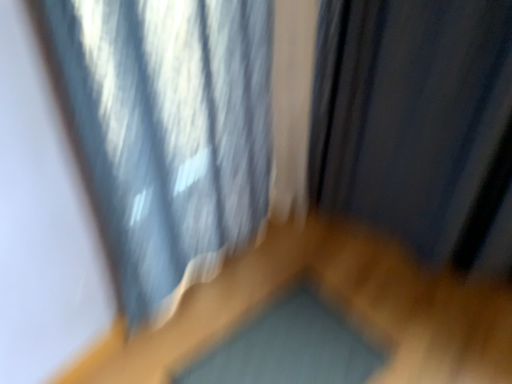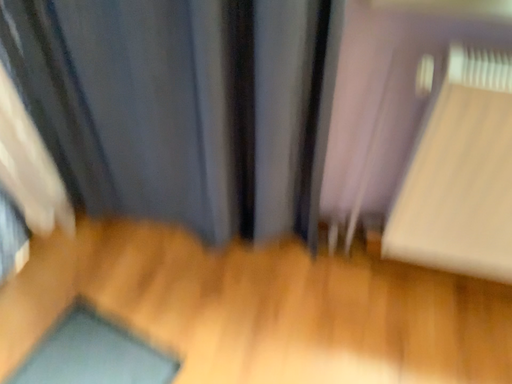
Question: How did the camera likely rotate when shooting the video?

Choices:
 (A) rotated right
 (B) rotated left

Answer: (A)